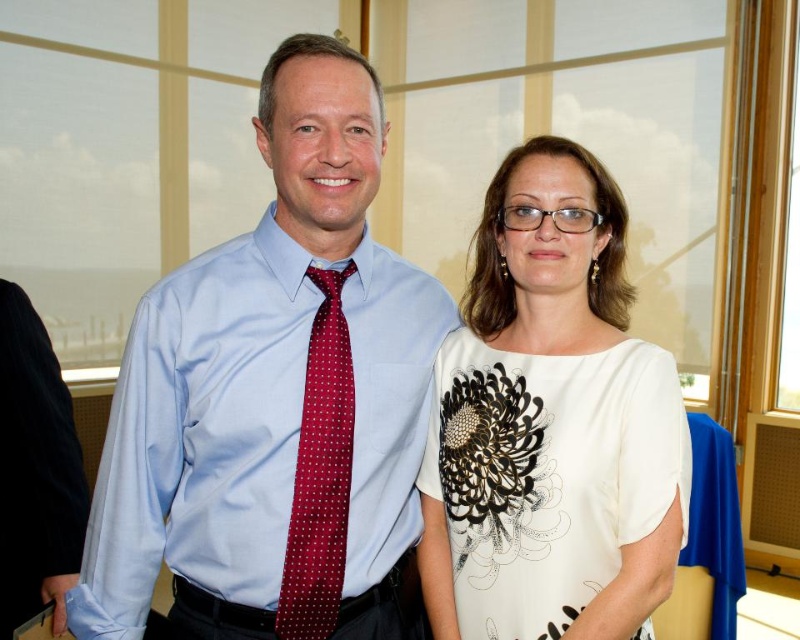
In the image, you see a white printed blouse at center and a maroon silk tie at center. Which one is positioned more to the right side?

The white printed blouse at center is positioned more to the right side than the maroon silk tie at center.

You are at a formal event and need to identify the clothing items worn by the two people in the image. Which clothing item is positioned higher up on the body between the light blue shirt at center and the white printed blouse at center?

The light blue shirt at center is positioned higher up on the body than the white printed blouse at center, as it is located above it according to the description.